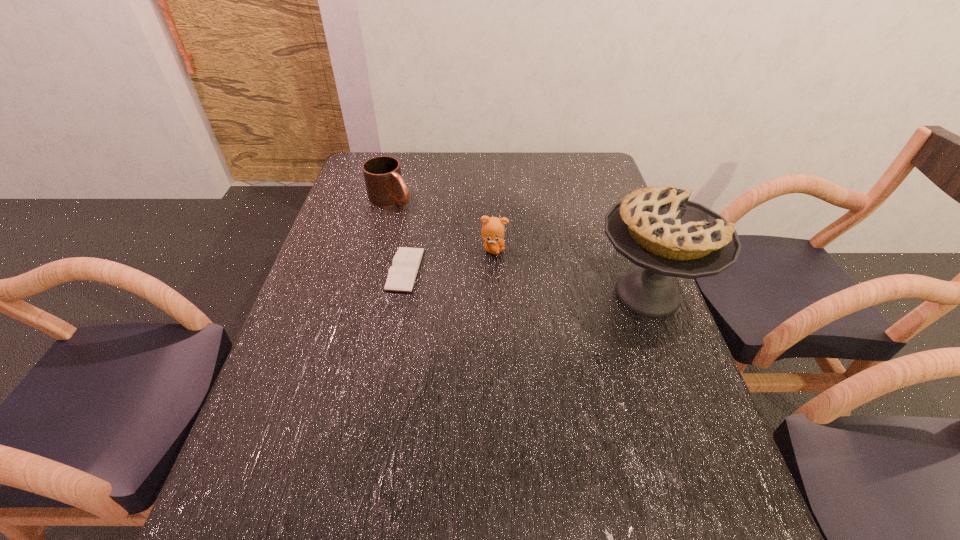
Where is `vacant space on the desktop that is between the diary and the rightmost object and is positioned on the side of the farthest object with the handle`? vacant space on the desktop that is between the diary and the rightmost object and is positioned on the side of the farthest object with the handle is located at coordinates (524, 281).

The width and height of the screenshot is (960, 540). Find the location of `vacant space on the desktop that is between the shortest object and the tallest object and is positioned on the face of the teddy bear`. vacant space on the desktop that is between the shortest object and the tallest object and is positioned on the face of the teddy bear is located at coordinates (549, 284).